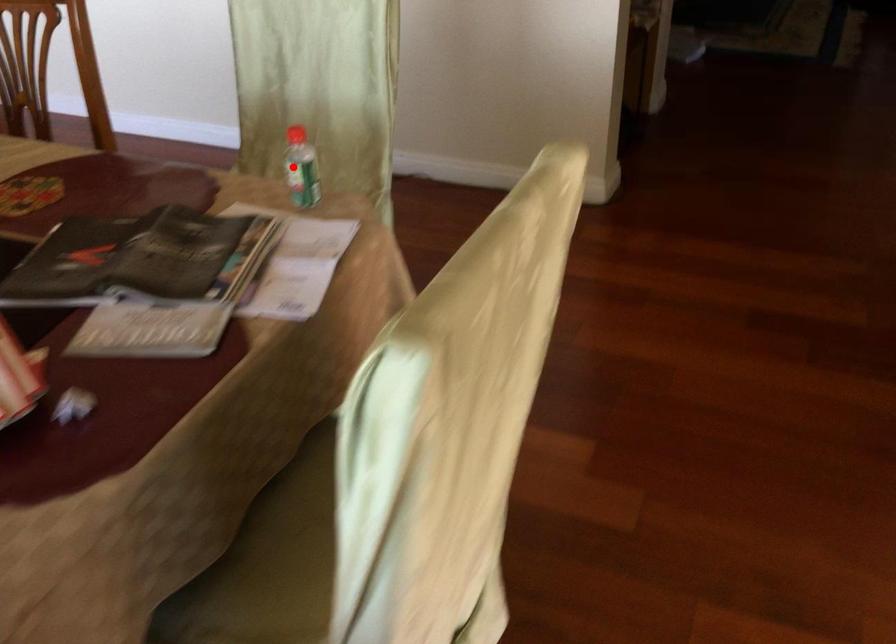
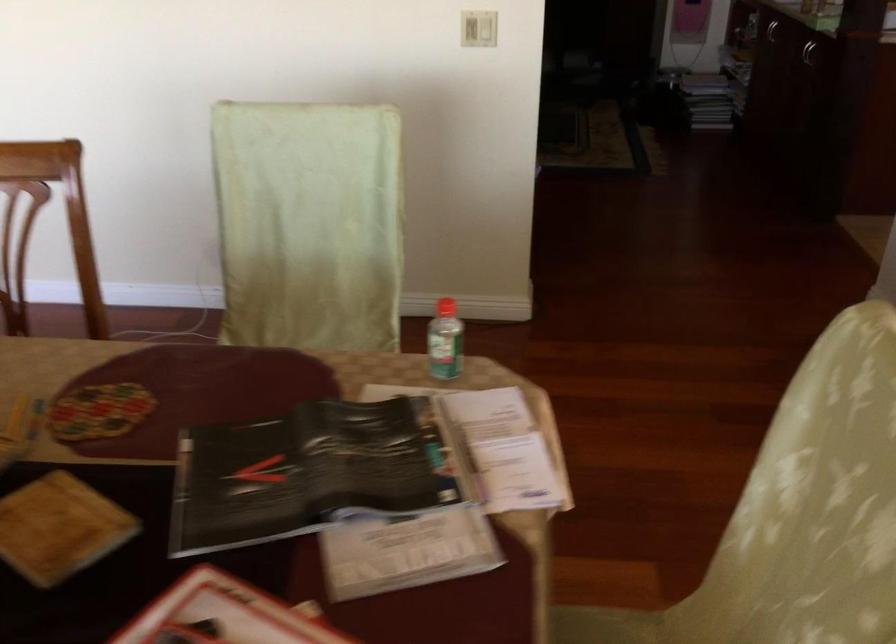
Where in the second image is the point corresponding to the highlighted location from the first image?

(444, 341)